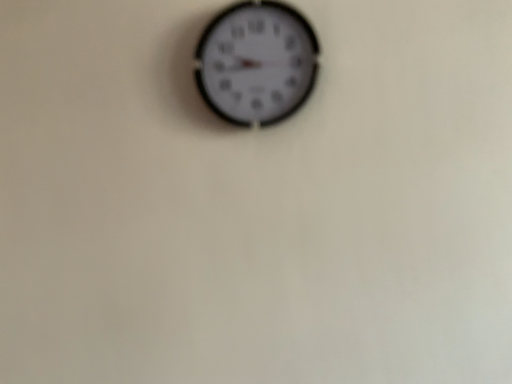
Describe the element at coordinates (256, 63) in the screenshot. I see `white glossy wall clock at upper center` at that location.

Locate an element on the screen. This screenshot has height=384, width=512. white glossy wall clock at upper center is located at coordinates (256, 63).

Locate an element on the screen. white glossy wall clock at upper center is located at coordinates (256, 63).